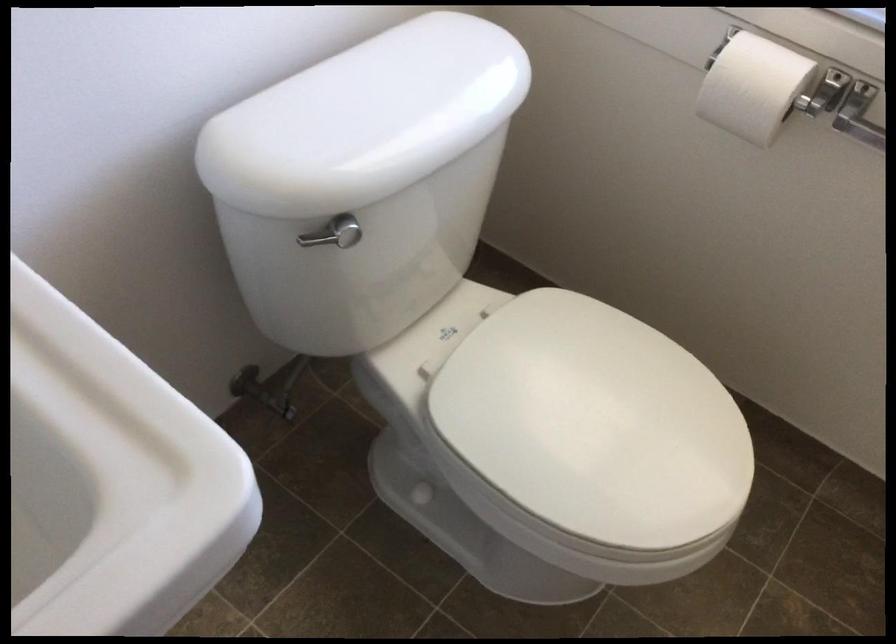
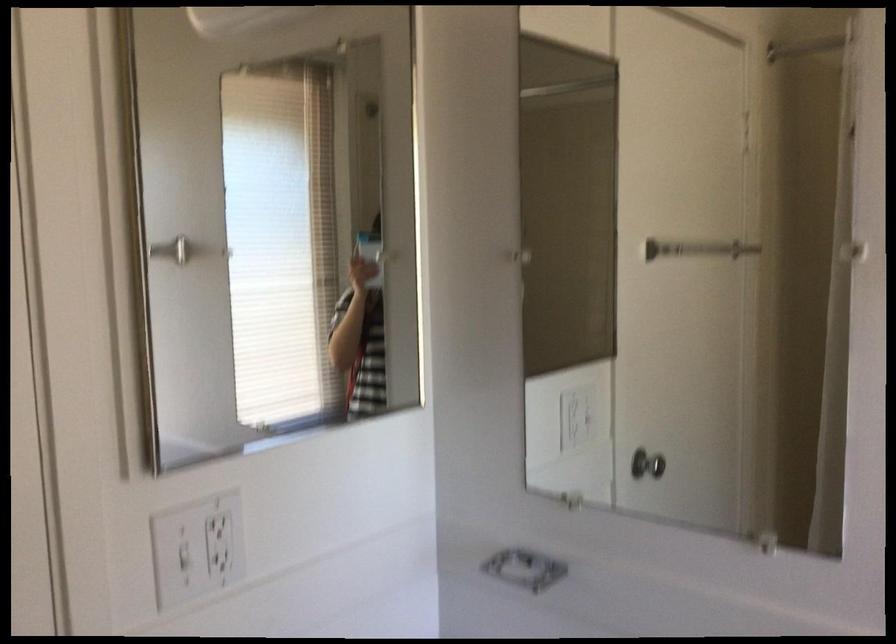
Question: The images are taken continuously from a first-person perspective. In which direction is your viewpoint rotating?

Choices:
 (A) Left
 (B) Right
 (C) Up
 (D) Down

Answer: (A)